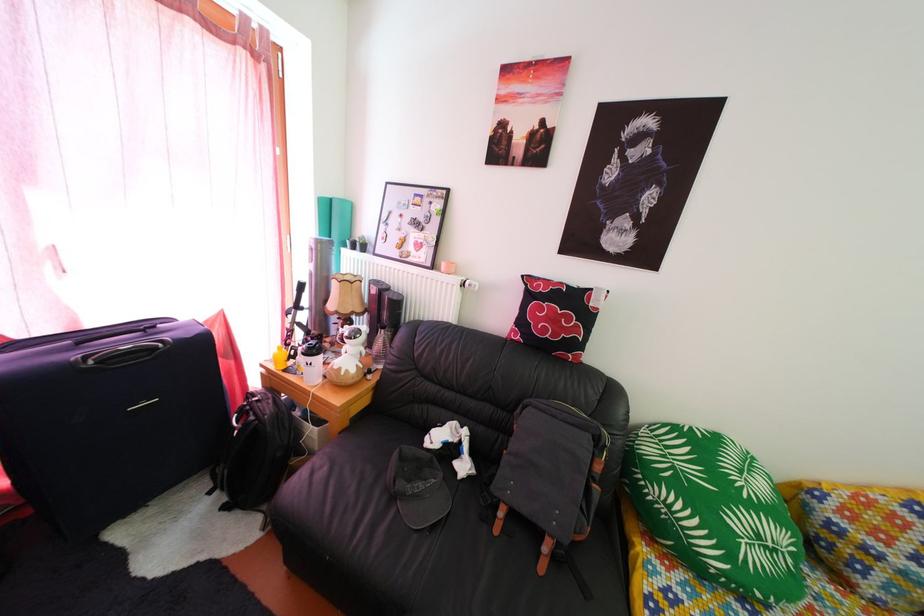
Find the location of a particular element. The width and height of the screenshot is (924, 616). backpack handle is located at coordinates (575, 406).